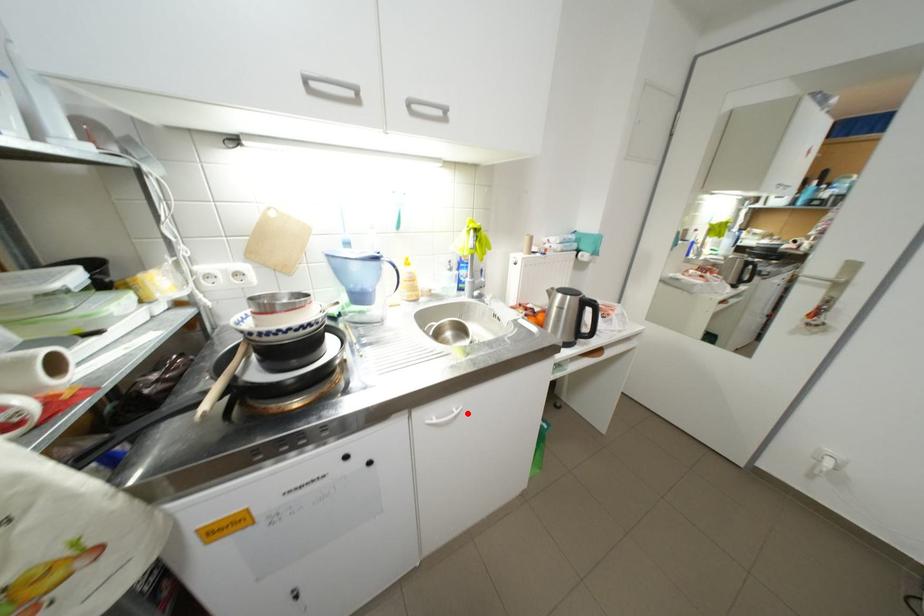
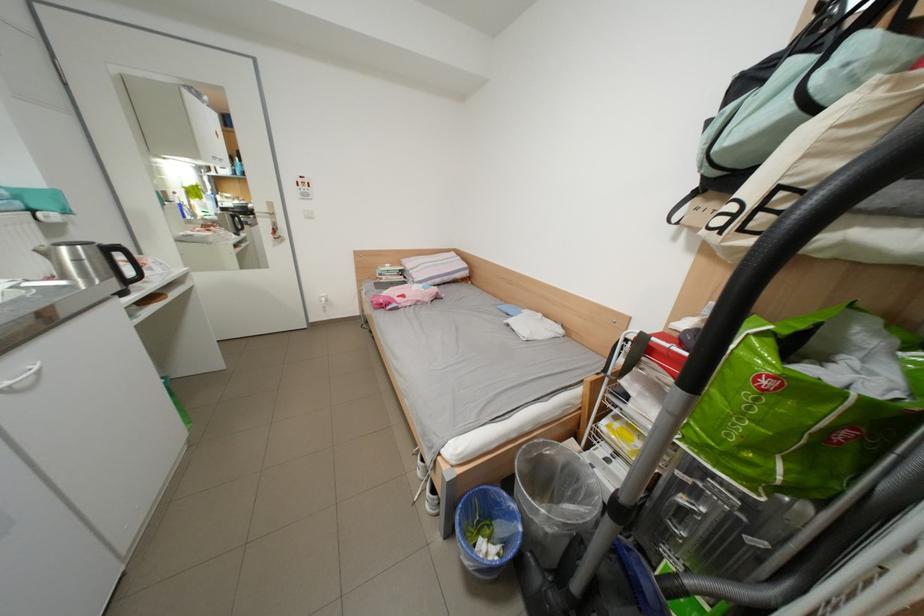
In the second image, find the point that corresponds to the highlighted location in the first image.

(46, 369)